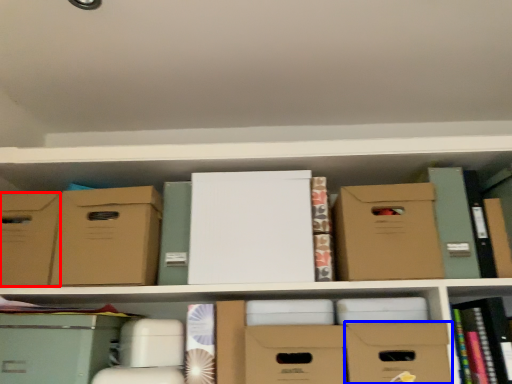
Question: Which of the following is the closest to the observer, storage box (highlighted by a red box) or storage box (highlighted by a blue box)?

Choices:
 (A) storage box
 (B) storage box

Answer: (B)